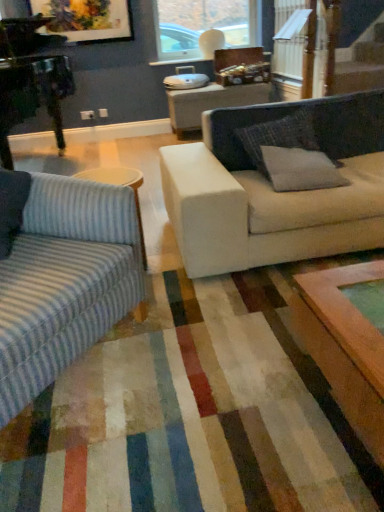
Question: Does transparent glass window at upper center have a greater height compared to gray fabric pillow at right, which ranks as the second pillow in back-to-front order?

Choices:
 (A) no
 (B) yes

Answer: (B)

Question: Is transparent glass window at upper center not close to gray fabric pillow at right, which ranks as the second pillow in back-to-front order?

Choices:
 (A) yes
 (B) no

Answer: (A)

Question: Is the depth of transparent glass window at upper center greater than that of gray fabric pillow at right, which ranks as the second pillow in back-to-front order?

Choices:
 (A) no
 (B) yes

Answer: (B)

Question: Considering the relative sizes of transparent glass window at upper center and gray fabric pillow at right, marked as the first pillow in a front-to-back arrangement, in the image provided, is transparent glass window at upper center thinner than gray fabric pillow at right, marked as the first pillow in a front-to-back arrangement,?

Choices:
 (A) yes
 (B) no

Answer: (A)

Question: Can you confirm if transparent glass window at upper center is shorter than gray fabric pillow at right, which ranks as the second pillow in back-to-front order?

Choices:
 (A) no
 (B) yes

Answer: (A)

Question: Is striped fabric couch at left in front of or behind matte wooden picture frame at upper left in the image?

Choices:
 (A) front
 (B) behind

Answer: (A)

Question: Considering the positions of striped fabric couch at left and matte wooden picture frame at upper left in the image, is striped fabric couch at left bigger or smaller than matte wooden picture frame at upper left?

Choices:
 (A) big
 (B) small

Answer: (A)

Question: Do you think striped fabric couch at left is within matte wooden picture frame at upper left, or outside of it?

Choices:
 (A) outside
 (B) inside

Answer: (A)

Question: From the image's perspective, is striped fabric couch at left positioned above or below matte wooden picture frame at upper left?

Choices:
 (A) below
 (B) above

Answer: (A)

Question: Does point coord(266,131) appear closer or farther from the camera than point coord(64,3)?

Choices:
 (A) farther
 (B) closer

Answer: (B)

Question: From their relative heights in the image, would you say gray fabric pillow at center, which ranks as the 2th pillow in front-to-back order, is taller or shorter than matte wooden picture frame at upper left?

Choices:
 (A) tall
 (B) short

Answer: (B)

Question: Considering the positions of gray fabric pillow at center, placed as the 1th pillow when sorted from back to front, and matte wooden picture frame at upper left in the image, is gray fabric pillow at center, placed as the 1th pillow when sorted from back to front, wider or thinner than matte wooden picture frame at upper left?

Choices:
 (A) thin
 (B) wide

Answer: (B)

Question: From the image's perspective, relative to matte wooden picture frame at upper left, is gray fabric pillow at center, placed as the 1th pillow when sorted from back to front, above or below?

Choices:
 (A) below
 (B) above

Answer: (A)

Question: Is point (173, 3) closer or farther from the camera than point (54, 359)?

Choices:
 (A) closer
 (B) farther

Answer: (B)

Question: Is transparent glass window at upper center inside the boundaries of striped fabric couch at left, or outside?

Choices:
 (A) outside
 (B) inside

Answer: (A)